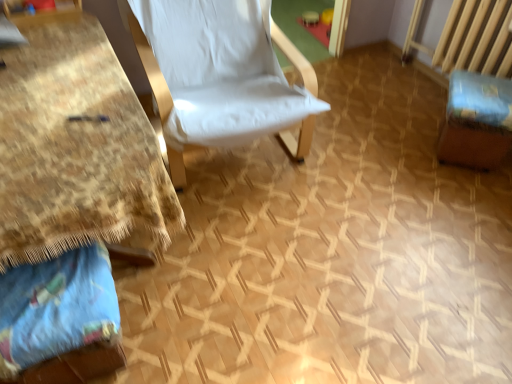
At what (x,y) coordinates should I click in order to perform the action: click on free location in front of white fabric chair at center. Please return your answer as a coordinate pair (x, y). Image resolution: width=512 pixels, height=384 pixels. Looking at the image, I should click on (281, 261).